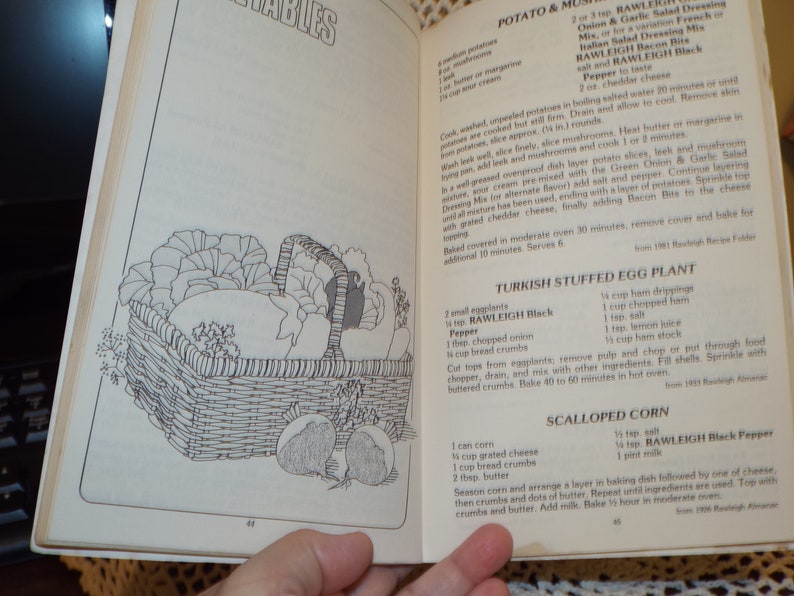
The height and width of the screenshot is (596, 794). I want to click on basket handle, so click(x=333, y=263).